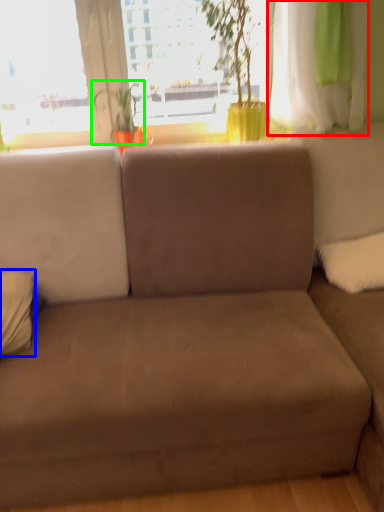
Question: Considering the real-world distances, which object is farthest from curtain (highlighted by a red box)? pillow (highlighted by a blue box) or plant (highlighted by a green box)?

Choices:
 (A) pillow
 (B) plant

Answer: (A)